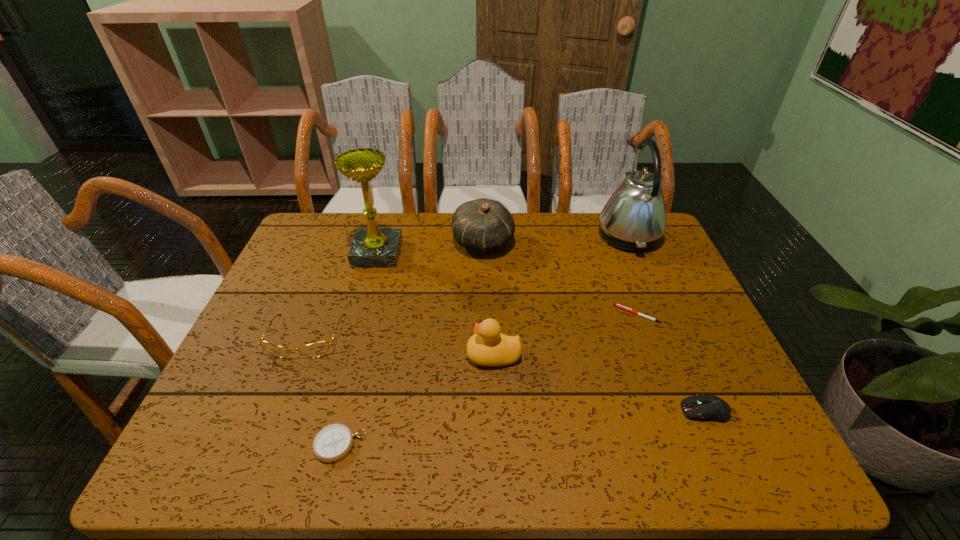
Image resolution: width=960 pixels, height=540 pixels. Find the location of `object that is the fifth nearest to the kettle`. object that is the fifth nearest to the kettle is located at coordinates (371, 248).

Locate an element on the screen. The height and width of the screenshot is (540, 960). blank space that satisfies the following two spatial constraints: 1. on the front-facing side of the nearest object; 2. on the right side of the fifth tallest object is located at coordinates (264, 445).

Locate an element on the screen. Image resolution: width=960 pixels, height=540 pixels. free space in the image that satisfies the following two spatial constraints: 1. on the front-facing side of the nearest object; 2. on the left side of the award is located at coordinates (324, 445).

The width and height of the screenshot is (960, 540). I want to click on free location that satisfies the following two spatial constraints: 1. from the spout of the kettle; 2. on the front-facing side of the spectacles, so point(671,337).

This screenshot has height=540, width=960. I want to click on vacant position in the image that satisfies the following two spatial constraints: 1. on the front-facing side of the award; 2. on the left side of the compass, so pos(324,445).

Find the location of `vacant space that satisfies the following two spatial constraints: 1. on the clicker of the shortest object; 2. on the front-facing side of the fourth shortest object`. vacant space that satisfies the following two spatial constraints: 1. on the clicker of the shortest object; 2. on the front-facing side of the fourth shortest object is located at coordinates (645, 337).